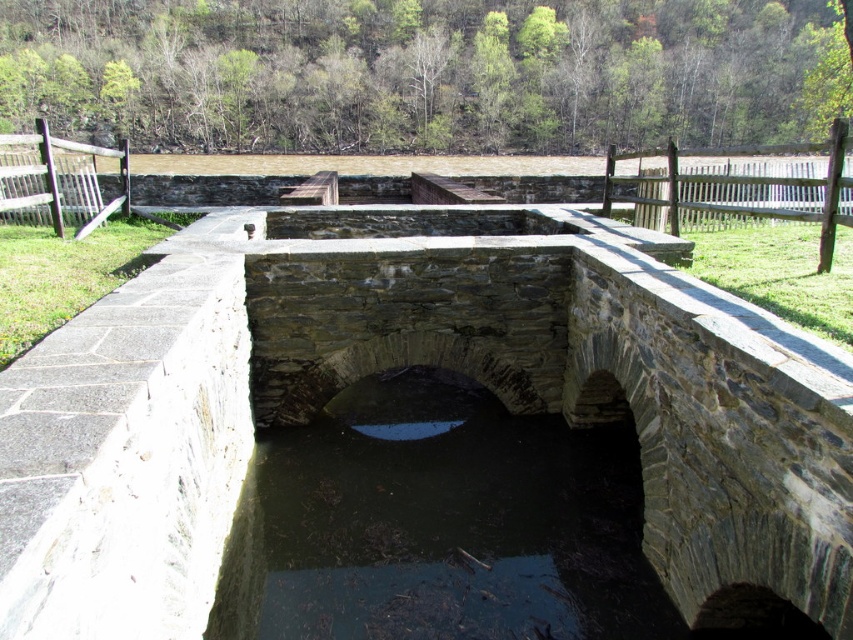
Question: Is gray stone bridge at center below dark stone water at center?

Choices:
 (A) yes
 (B) no

Answer: (B)

Question: In this image, where is gray stone bridge at center located relative to dark stone water at center?

Choices:
 (A) below
 (B) above

Answer: (B)

Question: Which point is farther to the camera?

Choices:
 (A) (674, 577)
 (B) (403, 506)

Answer: (B)

Question: Which point appears farthest from the camera in this image?

Choices:
 (A) (752, 577)
 (B) (479, 589)

Answer: (B)

Question: Does gray stone bridge at center have a smaller size compared to dark stone water at center?

Choices:
 (A) yes
 (B) no

Answer: (B)